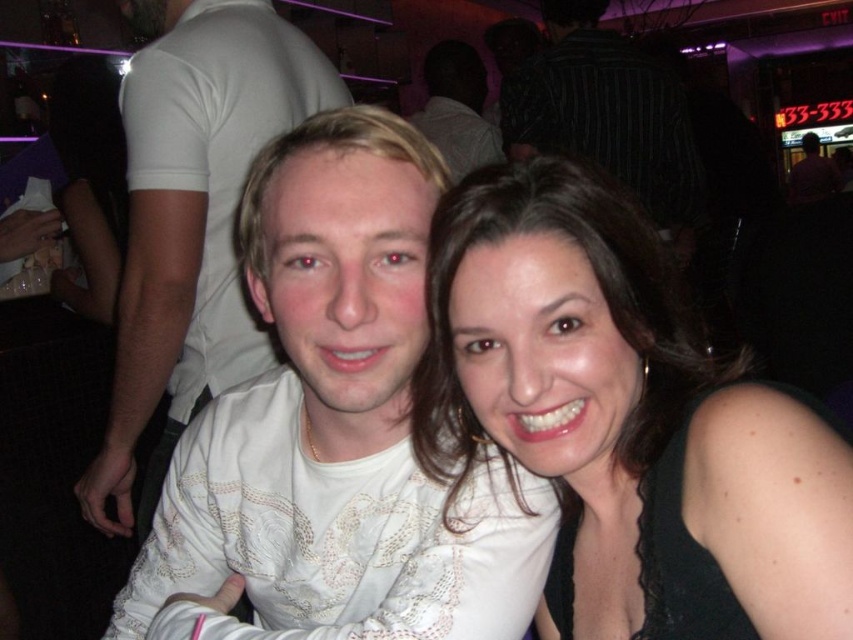
Between striped shirt at upper center and white lace shirt at center, which one is positioned lower?

striped shirt at upper center

Does striped shirt at upper center appear on the right side of white lace shirt at center?

Correct, you'll find striped shirt at upper center to the right of white lace shirt at center.

Is point (579, 10) positioned after point (482, 138)?

That is False.

You are a GUI agent. You are given a task and a screenshot of the screen. Output one action in this format:
    pyautogui.click(x=<x>, y=<y>)
    Task: Click on the striped shirt at upper center
    The width and height of the screenshot is (853, 640).
    Given the screenshot: What is the action you would take?
    pyautogui.click(x=606, y=112)

Find the location of a particular element. The height and width of the screenshot is (640, 853). white lace shirt at left is located at coordinates (192, 216).

Between white lace shirt at left and striped shirt at upper center, which one is positioned higher?

striped shirt at upper center is above.

Does point (213, 81) come closer to viewer compared to point (550, 17)?

Yes, point (213, 81) is in front of point (550, 17).

This screenshot has width=853, height=640. What are the coordinates of `white lace shirt at left` in the screenshot? It's located at (192, 216).

Can you confirm if white textured shirt at center is smaller than white lace shirt at center?

Correct, white textured shirt at center occupies less space than white lace shirt at center.

Between white textured shirt at center and white lace shirt at center, which one has more height?

white textured shirt at center

Where is `white textured shirt at center`? white textured shirt at center is located at coordinates (337, 432).